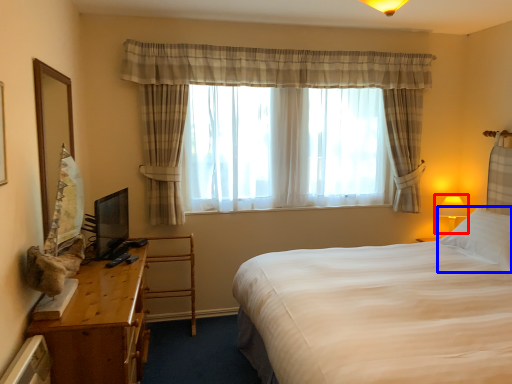
Question: Which object appears closest to the camera in this image, table lamp (highlighted by a red box) or pillow (highlighted by a blue box)?

Choices:
 (A) table lamp
 (B) pillow

Answer: (B)